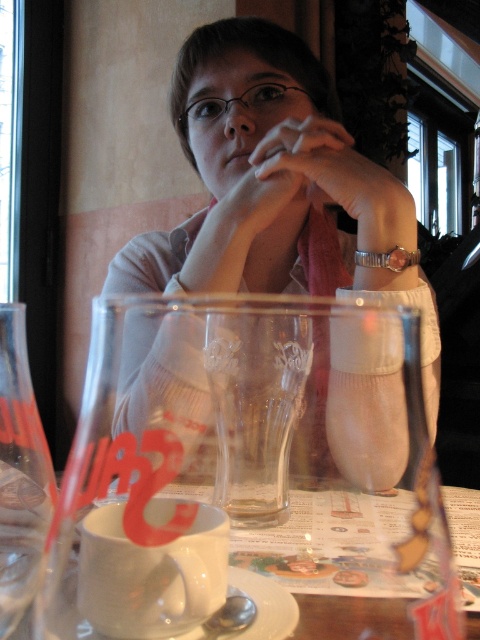
You are a barista trying to place a new drink order on the table. The matte white sweater at center and the transparent glass at center are already there. Can you fit the new drink on the table without moving either of them?

The matte white sweater at center occupies less space than transparent glass at center, so there might still be enough space for the new drink if the remaining area is sufficient. However, since the sweater takes up less space, moving it could allow more room, but the question specifies not moving them. Check the total available space after accounting for both items.

You are a barista trying to place the white matte cup at lower center on a shelf next to the matte skin hand at center. Given that the shelf has limited height, can the cup fit vertically without touching the hand?

The white matte cup at lower center is shorter than the matte skin hand at center, so it can fit vertically on the shelf without touching the hand as long as the shelf height accommodates the cup.